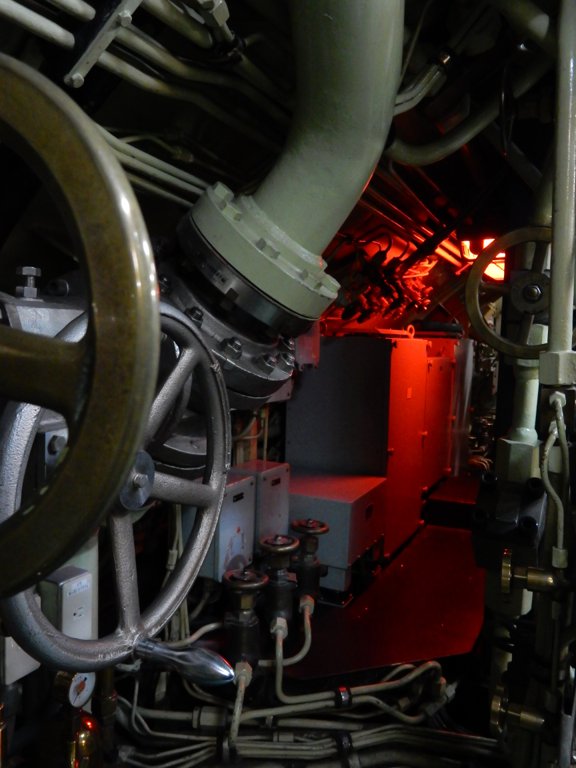
The image size is (576, 768). What are the coordinates of `light` in the screenshot? It's located at (466, 253).